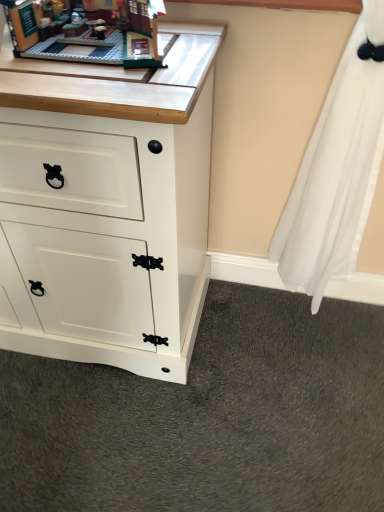
Question: From a real-world perspective, is brick-like lego set at upper left physically above white matte cabinet at center?

Choices:
 (A) yes
 (B) no

Answer: (A)

Question: Does brick-like lego set at upper left appear on the left side of white matte cabinet at center?

Choices:
 (A) yes
 (B) no

Answer: (B)

Question: Can you confirm if brick-like lego set at upper left is shorter than white matte cabinet at center?

Choices:
 (A) no
 (B) yes

Answer: (B)

Question: Is brick-like lego set at upper left completely or partially outside of white matte cabinet at center?

Choices:
 (A) yes
 (B) no

Answer: (A)

Question: Can you confirm if brick-like lego set at upper left is smaller than white matte cabinet at center?

Choices:
 (A) yes
 (B) no

Answer: (A)

Question: Does brick-like lego set at upper left appear on the right side of white matte cabinet at center?

Choices:
 (A) no
 (B) yes

Answer: (B)

Question: Can you confirm if white matte cabinet at center is smaller than brick-like lego set at upper left?

Choices:
 (A) no
 (B) yes

Answer: (A)

Question: From a real-world perspective, is white matte cabinet at center below brick-like lego set at upper left?

Choices:
 (A) yes
 (B) no

Answer: (A)

Question: Does white matte cabinet at center have a lesser width compared to brick-like lego set at upper left?

Choices:
 (A) no
 (B) yes

Answer: (A)

Question: From a real-world perspective, is white matte cabinet at center on top of brick-like lego set at upper left?

Choices:
 (A) yes
 (B) no

Answer: (B)

Question: Is white matte cabinet at center beside brick-like lego set at upper left?

Choices:
 (A) no
 (B) yes

Answer: (A)

Question: Would you say white matte cabinet at center contains brick-like lego set at upper left?

Choices:
 (A) yes
 (B) no

Answer: (B)

Question: Do you think white matte cabinet at center is within brick-like lego set at upper left, or outside of it?

Choices:
 (A) inside
 (B) outside

Answer: (B)